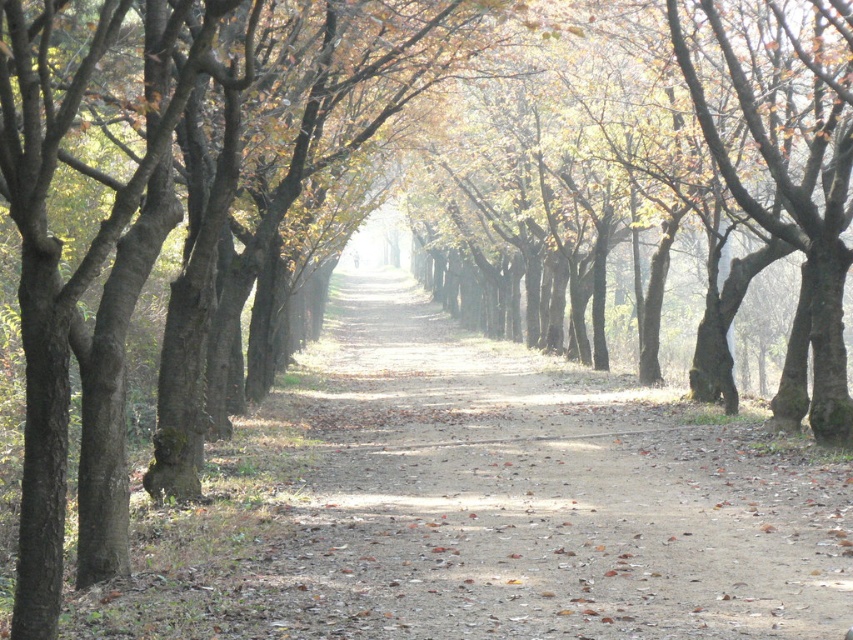
Does dirt path at center have a lesser height compared to brown smooth tree at center?

Correct, dirt path at center is not as tall as brown smooth tree at center.

Between dirt path at center and brown smooth tree at center, which one has less height?

dirt path at center

Measure the distance between dirt path at center and camera.

dirt path at center and camera are 8.00 meters apart from each other.

Find the location of a particular element. The image size is (853, 640). dirt path at center is located at coordinates (543, 499).

Is dirt path at center positioned behind brown rough bark tree at right?

No, dirt path at center is in front of brown rough bark tree at right.

This screenshot has height=640, width=853. Find the location of `dirt path at center`. dirt path at center is located at coordinates point(543,499).

Is point (688, 564) more distant than point (817, 381)?

That is False.

This screenshot has height=640, width=853. Find the location of `dirt path at center`. dirt path at center is located at coordinates (543, 499).

The height and width of the screenshot is (640, 853). What do you see at coordinates (746, 164) in the screenshot?
I see `brown smooth tree at center` at bounding box center [746, 164].

Does point (509, 109) come farther from viewer compared to point (811, 227)?

Yes, point (509, 109) is behind point (811, 227).

Identify the location of brown smooth tree at center. This screenshot has width=853, height=640. (746, 164).

The height and width of the screenshot is (640, 853). I want to click on brown smooth tree at center, so click(746, 164).